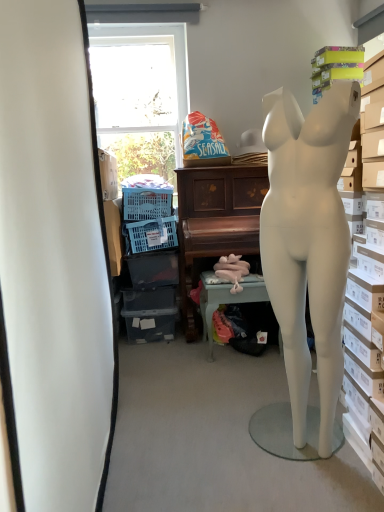
In order to click on white matte mannequin at right in this screenshot , I will do `click(308, 241)`.

Locate an element on the screen. blue plastic laundry basket at lower left is located at coordinates (152, 234).

In order to face pink fabric-covered table at center, should I rotate leftwards or rightwards?

Rotate your view right by about 6.939°.

What is the approximate width of pink fabric-covered table at center?

pink fabric-covered table at center is 14.26 inches wide.

What do you see at coordinates (215, 222) in the screenshot? I see `wooden piano at center` at bounding box center [215, 222].

Locate an element on the screen. The image size is (384, 512). white matte mannequin at right is located at coordinates (308, 241).

Does point (148, 247) come behind point (295, 213)?

That is True.

From the image's perspective, which one is positioned higher, blue plastic laundry basket at lower left or white matte mannequin at right?

blue plastic laundry basket at lower left, from the image's perspective.

Are blue plastic laundry basket at lower left and white matte mannequin at right far apart?

Yes, blue plastic laundry basket at lower left is far from white matte mannequin at right.

Based on the photo, how far apart are blue plastic laundry basket at lower left and white matte mannequin at right?

blue plastic laundry basket at lower left and white matte mannequin at right are 4.61 feet apart from each other.

Is wooden piano at center facing towards pink fabric-covered table at center?

Yes, wooden piano at center is facing pink fabric-covered table at center.

Based on their positions, is wooden piano at center located to the left or right of pink fabric-covered table at center?

From the image, it's evident that wooden piano at center is to the left of pink fabric-covered table at center.

Does point (187, 217) lie in front of point (202, 312)?

That is True.

Are wooden piano at center and pink fabric-covered table at center located far from each other?

No, wooden piano at center is not far from pink fabric-covered table at center.

Considering the relative sizes of blue plastic laundry basket at lower left and wooden piano at center in the image provided, is blue plastic laundry basket at lower left wider than wooden piano at center?

In fact, blue plastic laundry basket at lower left might be narrower than wooden piano at center.

Is wooden piano at center at the back of blue plastic laundry basket at lower left?

No.

Is point (167, 217) behind point (233, 174)?

That is True.

Is there a large distance between pink fabric-covered table at center and wooden piano at center?

pink fabric-covered table at center is near wooden piano at center, not far away.

From a real-world perspective, relative to wooden piano at center, is pink fabric-covered table at center vertically above or below?

pink fabric-covered table at center is situated lower than wooden piano at center in the real world.

From the image's perspective, between pink fabric-covered table at center and wooden piano at center, who is located below?

From the image's view, pink fabric-covered table at center is below.

Is pink fabric-covered table at center to the left of wooden piano at center from the viewer's perspective?

No.

In the scene shown: Which of these two, pink fabric-covered table at center or white matte mannequin at right, is wider?

pink fabric-covered table at center is wider.

Between pink fabric-covered table at center and white matte mannequin at right, which one has more height?

Standing taller between the two is white matte mannequin at right.

Which is behind, point (208, 296) or point (273, 167)?

The point (208, 296) is more distant.

Between pink fabric-covered table at center and white matte mannequin at right, which one appears on the left side from the viewer's perspective?

Positioned to the left is pink fabric-covered table at center.

Which is more to the left, wooden piano at center or blue plastic laundry basket at lower left?

blue plastic laundry basket at lower left.

How many degrees apart are the facing directions of wooden piano at center and blue plastic laundry basket at lower left?

There is a 0.00149-degree angle between the facing directions of wooden piano at center and blue plastic laundry basket at lower left.

Is the position of wooden piano at center more distant than that of blue plastic laundry basket at lower left?

That is False.

Looking at this image, could you tell me if wooden piano at center is facing blue plastic laundry basket at lower left?

No, wooden piano at center is not facing towards blue plastic laundry basket at lower left.

Considering the positions of objects white matte mannequin at right and wooden piano at center in the image provided, who is more to the left, white matte mannequin at right or wooden piano at center?

wooden piano at center is more to the left.

Looking at this image, considering the relative sizes of white matte mannequin at right and wooden piano at center in the image provided, is white matte mannequin at right taller than wooden piano at center?

Yes, white matte mannequin at right is taller than wooden piano at center.

From a real-world perspective, relative to wooden piano at center, is white matte mannequin at right vertically above or below?

white matte mannequin at right is situated higher than wooden piano at center in the real world.

In order to click on person that appears below the blue plastic laundry basket at lower left (from the image's perspective) in this screenshot , I will do `click(308, 241)`.

Locate an element on the screen. The image size is (384, 512). furniture on the left of pink fabric-covered table at center is located at coordinates (215, 222).

From the image, which object appears to be nearer to blue plastic laundry basket at lower left, wooden piano at center or white matte mannequin at right?

Based on the image, wooden piano at center appears to be nearer to blue plastic laundry basket at lower left.

Considering their positions, is white matte mannequin at right positioned closer to wooden piano at center than blue plastic laundry basket at lower left?

blue plastic laundry basket at lower left lies closer to wooden piano at center than the other object.

Looking at the image, which one is located further to pink fabric-covered table at center, blue plastic laundry basket at lower left or white matte mannequin at right?

Based on the image, white matte mannequin at right appears to be further to pink fabric-covered table at center.

Considering their positions, is white matte mannequin at right positioned closer to pink fabric-covered table at center than blue plastic laundry basket at lower left?

blue plastic laundry basket at lower left.

From the image, which object appears to be farther from wooden piano at center, pink fabric-covered table at center or white matte mannequin at right?

white matte mannequin at right is further to wooden piano at center.

Looking at the image, which one is located further to wooden piano at center, pink fabric-covered table at center or blue plastic laundry basket at lower left?

Based on the image, blue plastic laundry basket at lower left appears to be further to wooden piano at center.

Consider the image. When comparing their distances from blue plastic laundry basket at lower left, does pink fabric-covered table at center or wooden piano at center seem further?

pink fabric-covered table at center lies further to blue plastic laundry basket at lower left than the other object.

When comparing their distances from white matte mannequin at right, does pink fabric-covered table at center or wooden piano at center seem further?

wooden piano at center lies further to white matte mannequin at right than the other object.

Where is `table between white matte mannequin at right and blue plastic laundry basket at lower left along the z-axis`? The height and width of the screenshot is (512, 384). table between white matte mannequin at right and blue plastic laundry basket at lower left along the z-axis is located at coordinates (227, 298).

At what (x,y) coordinates should I click in order to perform the action: click on furniture located between white matte mannequin at right and blue plastic laundry basket at lower left in the depth direction. Please return your answer as a coordinate pair (x, y). The width and height of the screenshot is (384, 512). Looking at the image, I should click on (215, 222).

Locate an element on the screen. The image size is (384, 512). furniture between blue plastic laundry basket at lower left and pink fabric-covered table at center in the horizontal direction is located at coordinates 215,222.

This screenshot has height=512, width=384. I want to click on table positioned between white matte mannequin at right and wooden piano at center from near to far, so click(x=227, y=298).